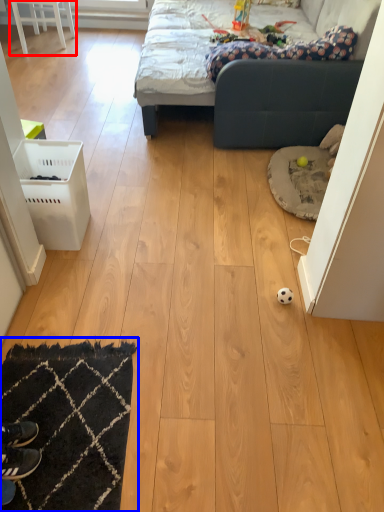
Question: Which object appears closest to the camera in this image, furniture (highlighted by a red box) or mat (highlighted by a blue box)?

Choices:
 (A) furniture
 (B) mat

Answer: (B)